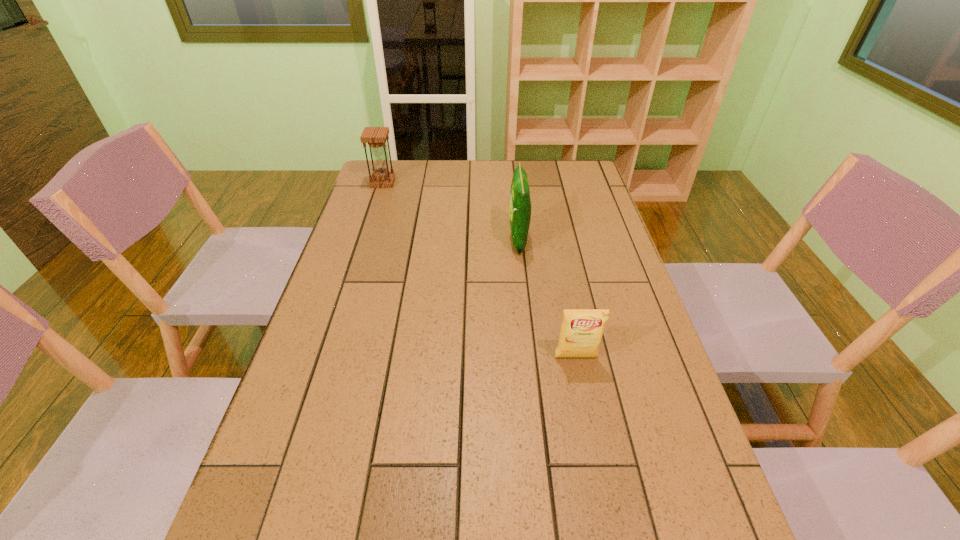
You are a GUI agent. You are given a task and a screenshot of the screen. Output one action in this format:
    pyautogui.click(x=<x>, y=<y>)
    Task: Click on the farther crisp (potato chip)
    Image resolution: width=960 pixels, height=540 pixels.
    Given the screenshot: What is the action you would take?
    pyautogui.click(x=519, y=204)

Image resolution: width=960 pixels, height=540 pixels. Find the location of `the left crisp (potato chip)`. the left crisp (potato chip) is located at coordinates (519, 204).

Identify the location of the leftmost object. (376, 137).

The width and height of the screenshot is (960, 540). Identify the location of hourglass. (376, 137).

The width and height of the screenshot is (960, 540). I want to click on the right crisp (potato chip), so click(x=581, y=332).

Where is `the rightmost object`? the rightmost object is located at coordinates (581, 332).

Locate an element on the screen. blank area located on the front-facing side of the farther crisp (potato chip) is located at coordinates pyautogui.click(x=467, y=240).

The height and width of the screenshot is (540, 960). In order to click on free space located on the front-facing side of the farther crisp (potato chip) in this screenshot , I will do `click(399, 240)`.

I want to click on free region located 0.310m on the front-facing side of the farther crisp (potato chip), so click(x=409, y=240).

This screenshot has height=540, width=960. Find the location of `free space located on the front of the leftmost object`. free space located on the front of the leftmost object is located at coordinates [367, 232].